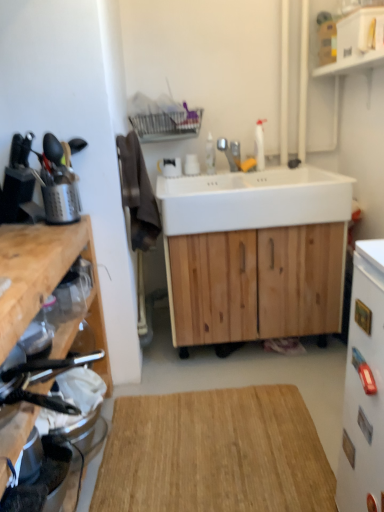
Identify the location of vacant space to the right of silver metallic faucet at center. (248, 172).